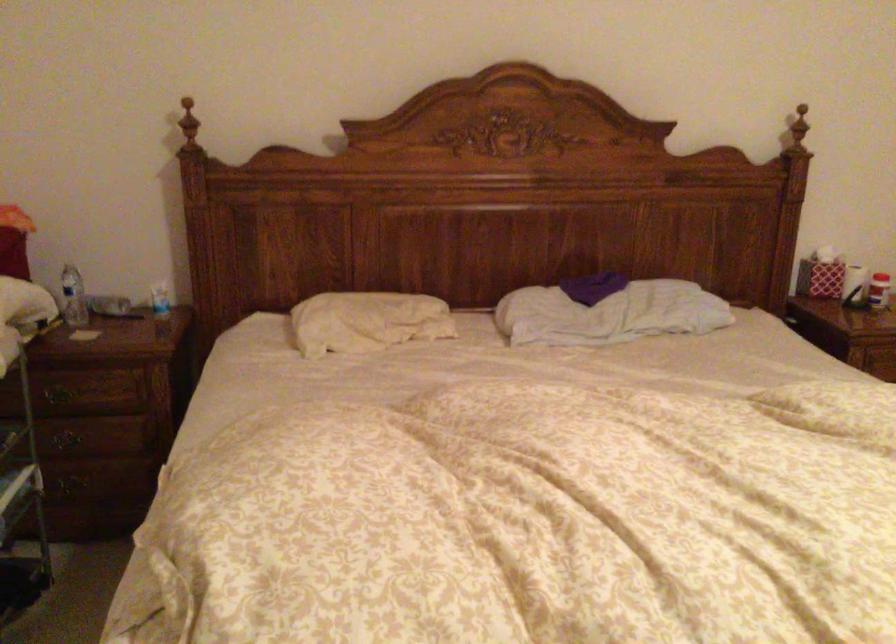
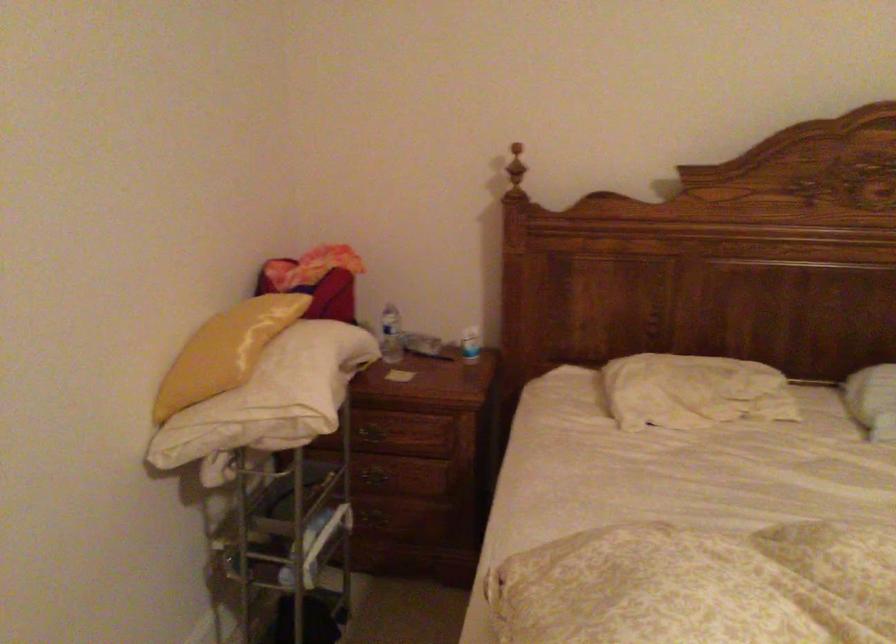
Locate, in the second image, the point that corresponds to [71,297] in the first image.

(391, 335)